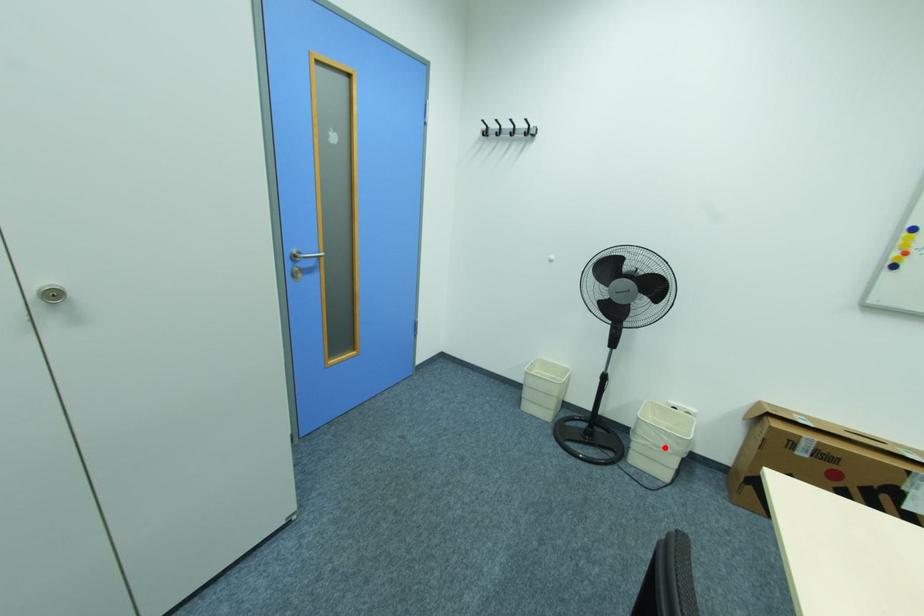
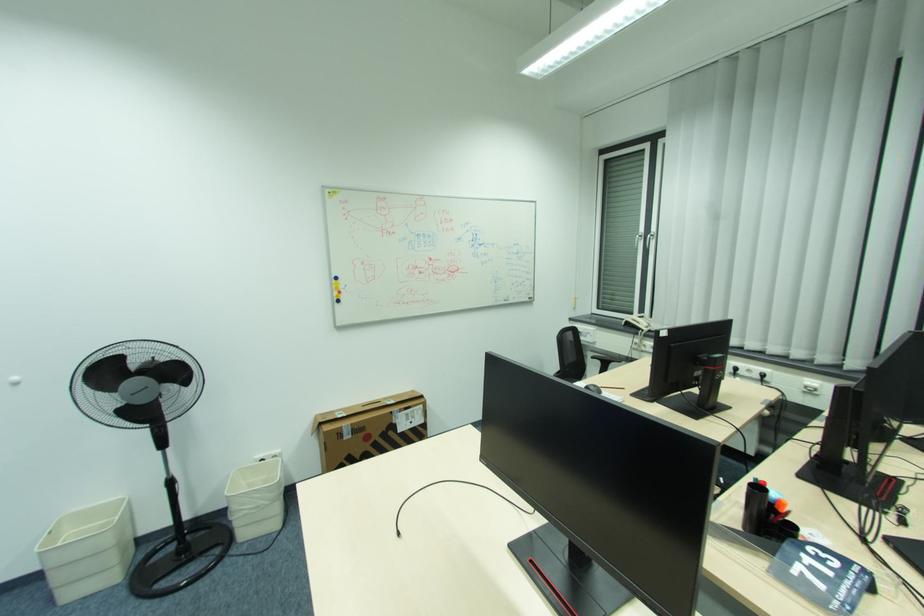
Question: I am providing you with two images of the same scene from different viewpoints. Image1 has a red point marked. In image2, the corresponding 3D location appears at what relative position? Reply with the corresponding letter.

Choices:
 (A) Closer
 (B) Farther

Answer: (A)